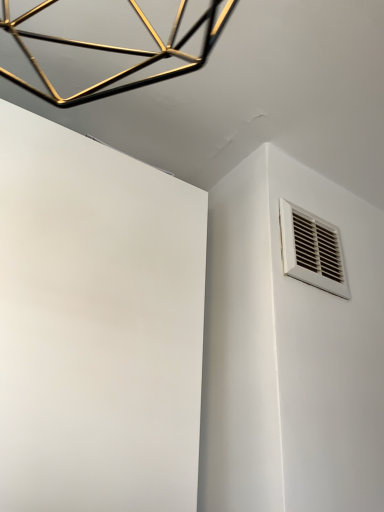
Measure the distance between white plastic vent at upper right and camera.

white plastic vent at upper right and camera are 29.94 inches apart.

This screenshot has height=512, width=384. Find the location of `white plastic vent at upper right`. white plastic vent at upper right is located at coordinates (312, 250).

In order to face white plastic vent at upper right, should I rotate leftwards or rightwards?

You should look right and rotate roughly 15.915 degrees.

Image resolution: width=384 pixels, height=512 pixels. What do you see at coordinates (312, 250) in the screenshot?
I see `white plastic vent at upper right` at bounding box center [312, 250].

What are the coordinates of `white plastic vent at upper right` in the screenshot? It's located at (312, 250).